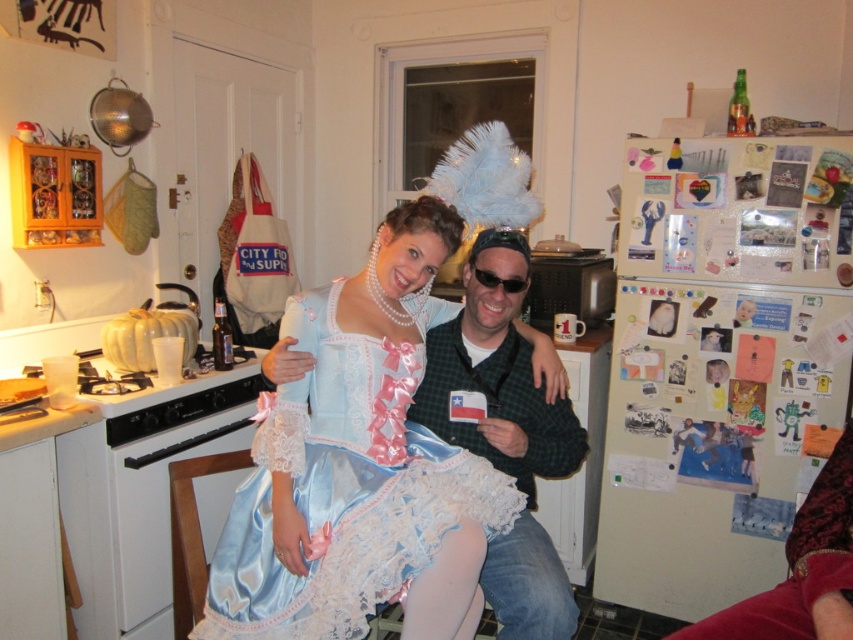
Question: Considering the relative positions of satin blue dress at center and black plastic sunglasses at center in the image provided, where is satin blue dress at center located with respect to black plastic sunglasses at center?

Choices:
 (A) above
 (B) below

Answer: (B)

Question: Does green plaid shirt at center lie in front of black plastic sunglasses at center?

Choices:
 (A) no
 (B) yes

Answer: (B)

Question: Which of these objects is positioned closest to the black plastic sunglasses at center?

Choices:
 (A) satin blue dress at center
 (B) green plaid shirt at center

Answer: (B)

Question: Observing the image, what is the correct spatial positioning of satin blue dress at center in reference to black plastic sunglasses at center?

Choices:
 (A) right
 (B) left

Answer: (B)

Question: Considering the real-world distances, which object is farthest from the satin blue dress at center?

Choices:
 (A) green plaid shirt at center
 (B) black plastic sunglasses at center

Answer: (B)

Question: Which object is closer to the camera taking this photo?

Choices:
 (A) green plaid shirt at center
 (B) satin blue dress at center
 (C) black plastic sunglasses at center

Answer: (B)